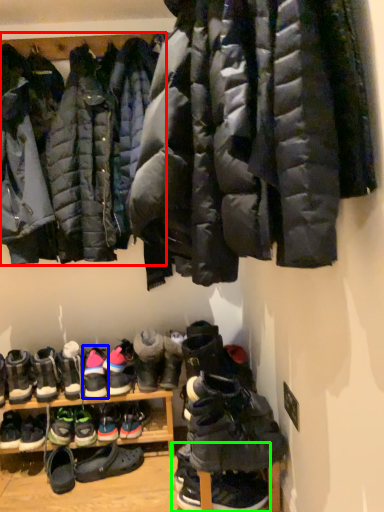
Question: Based on their relative distances, which object is farther from jacket (highlighted by a red box)? Choose from footwear (highlighted by a blue box) and footwear (highlighted by a green box).

Choices:
 (A) footwear
 (B) footwear

Answer: (B)